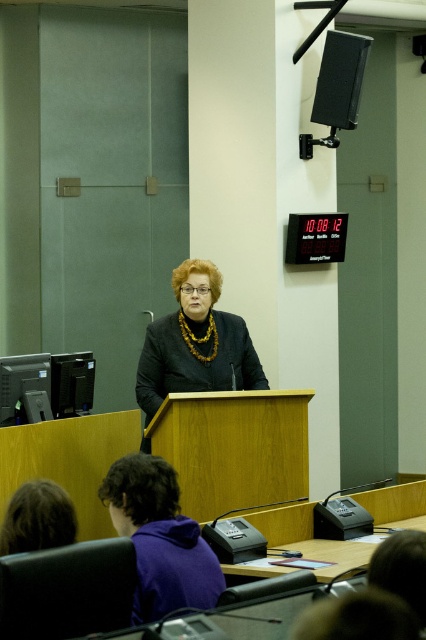
Question: Which point appears farthest from the camera in this image?

Choices:
 (A) (201, 589)
 (B) (198, 305)

Answer: (B)

Question: Which object is the closest to the black plastic printer at left?

Choices:
 (A) matte black speaker at upper right
 (B) black plastic computer at lower left

Answer: (B)

Question: Can you confirm if matte black jacket at center is positioned to the left of black plastic computer at lower left?

Choices:
 (A) yes
 (B) no

Answer: (B)

Question: Is matte black speaker at upper right wider than black plastic printer at left?

Choices:
 (A) no
 (B) yes

Answer: (B)

Question: Which point is farther from the camera taking this photo?

Choices:
 (A) (86, 376)
 (B) (201, 324)

Answer: (A)

Question: Can you confirm if matte black jacket at center is positioned to the right of black plastic computer at lower left?

Choices:
 (A) yes
 (B) no

Answer: (A)